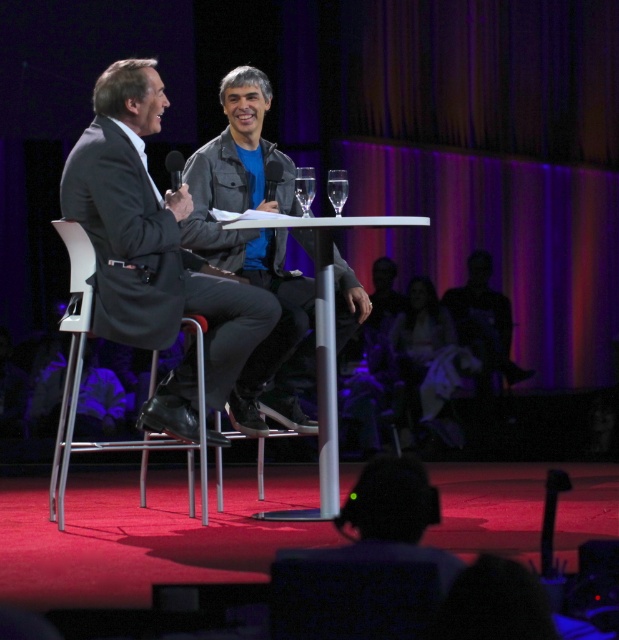
Who is shorter, dark gray suit at center or white glossy table at center?

With less height is white glossy table at center.

Does dark gray suit at center have a lesser width compared to white glossy table at center?

No, dark gray suit at center is not thinner than white glossy table at center.

I want to click on dark gray suit at center, so click(x=152, y=237).

Is gray leather jacket at center positioned in front of white plastic chair at left?

That is False.

Which is more to the left, gray leather jacket at center or white plastic chair at left?

white plastic chair at left

Is point (292, 292) closer to camera compared to point (167, 445)?

No, (292, 292) is behind (167, 445).

The height and width of the screenshot is (640, 619). I want to click on gray leather jacket at center, so click(254, 252).

Can you confirm if gray leather jacket at center is positioned above clear glass at center?

No.

Can you confirm if gray leather jacket at center is bigger than clear glass at center?

Yes.

Find the location of a particular element. This screenshot has width=619, height=640. gray leather jacket at center is located at coordinates (254, 252).

The height and width of the screenshot is (640, 619). Identify the location of gray leather jacket at center. (254, 252).